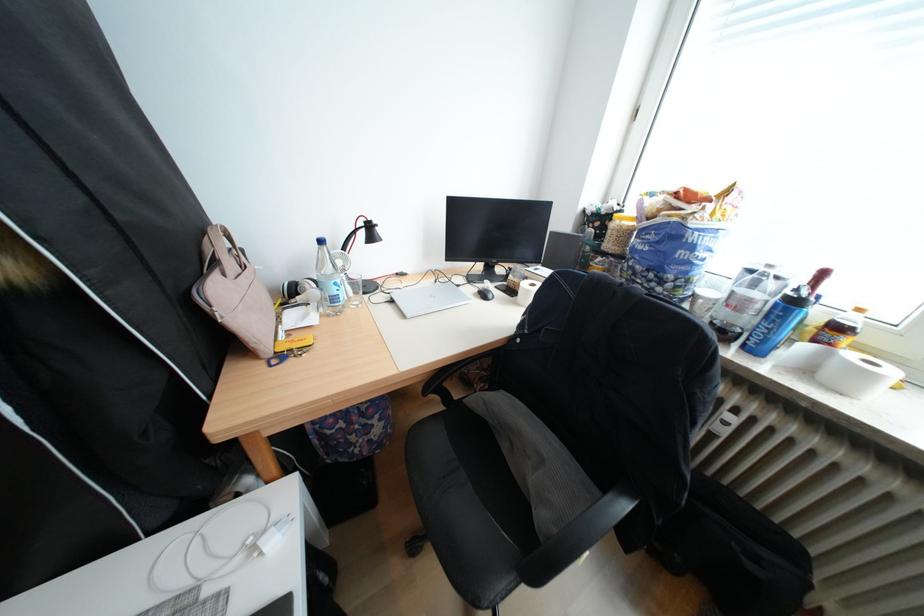
Describe the element at coordinates (734, 552) in the screenshot. I see `the black suitcase` at that location.